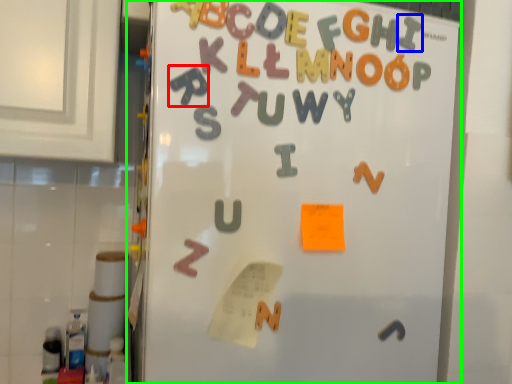
Question: Considering the real-world distances, which object is closest to alphabet (highlighted by a red box)? letter (highlighted by a blue box) or refrigerator (highlighted by a green box).

Choices:
 (A) letter
 (B) refrigerator

Answer: (B)